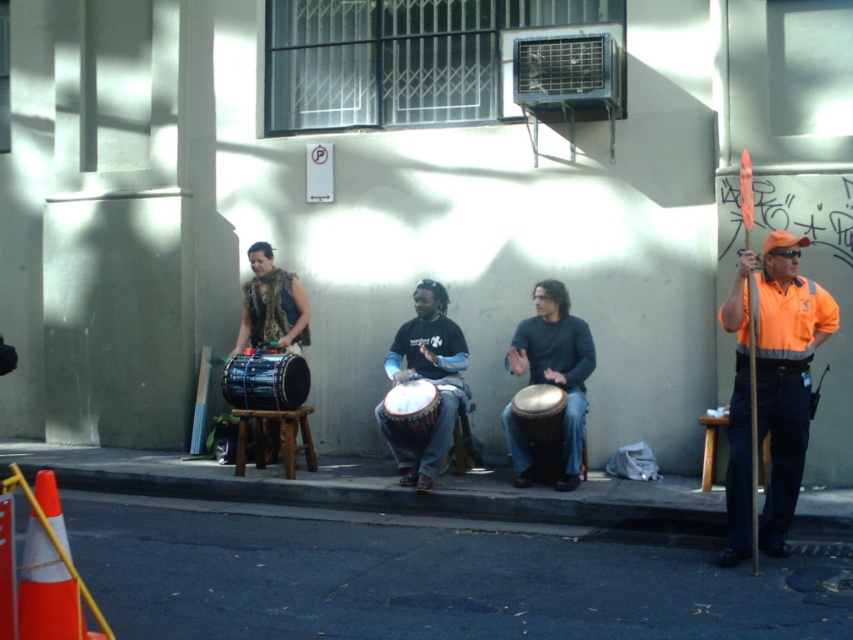
Based on the scene description, can you determine if the natural wood drum at center is resting on the dark asphalt pavement at lower center?

Yes, the dark asphalt pavement at lower center is below the natural wood drum at center, so the natural wood drum at center is resting on it.

You are a delivery person trying to navigate through the street scene. You need to place a package on the dark asphalt pavement at lower center. However, there is a natural wood drum at center in the way. Can you place the package directly in front of the drum?

The dark asphalt pavement at lower center is in front of the natural wood drum at center, so yes, you can place the package directly in front of the drum.

You are a passerby who wants to take a photo of the matte black drum at center without moving any objects. Based on the scene, where exactly is the matte black drum positioned relative to the other objects?

The matte black drum at center is located at point (x=427, y=380) in the image coordinates.